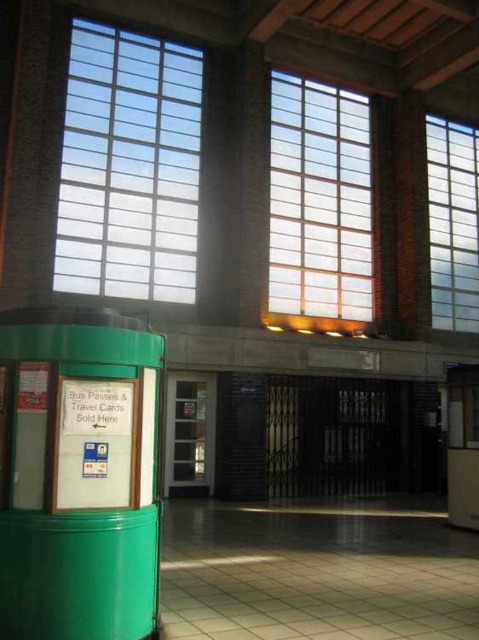
Is transparent glass window at upper left positioned behind translucent glass window at center?

No.

Who is shorter, transparent glass window at upper left or translucent glass window at center?

transparent glass window at upper left

What are the coordinates of `transparent glass window at upper left` in the screenshot? It's located at (128, 168).

You are a GUI agent. You are given a task and a screenshot of the screen. Output one action in this format:
    pyautogui.click(x=<x>, y=<y>)
    Task: Click on the transparent glass window at upper left
    The image size is (479, 640).
    Given the screenshot: What is the action you would take?
    (128, 168)

Is green matte phone box at lower left below clear glass window at upper right?

Yes, green matte phone box at lower left is below clear glass window at upper right.

Is point (78, 396) positioned before point (454, 144)?

Yes, it is.

At what (x,y) coordinates should I click in order to perform the action: click on green matte phone box at lower left. Please return your answer as a coordinate pair (x, y). This screenshot has width=479, height=640. Looking at the image, I should click on (79, 474).

Who is taller, green matte phone box at lower left or translucent glass window at center?

Standing taller between the two is translucent glass window at center.

Does point (141, 513) come in front of point (357, 164)?

That is True.

Is point (26, 406) closer to viewer compared to point (342, 177)?

Yes, point (26, 406) is in front of point (342, 177).

Where is `green matte phone box at lower left`? green matte phone box at lower left is located at coordinates (79, 474).